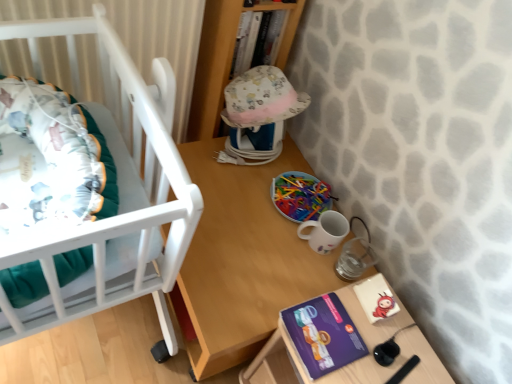
The height and width of the screenshot is (384, 512). I want to click on free region on the left part of multicolored plastic sticks at center, so click(x=240, y=179).